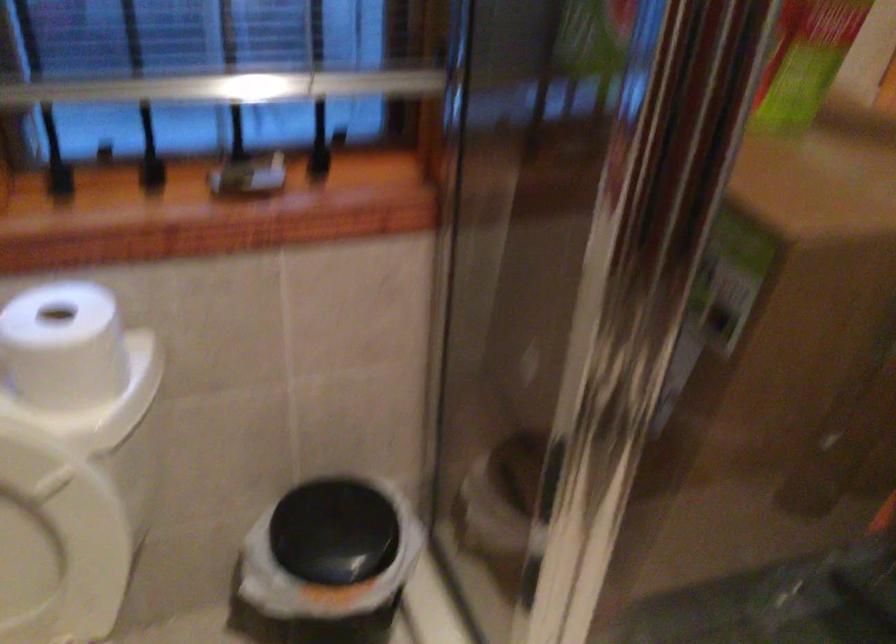
Image resolution: width=896 pixels, height=644 pixels. In order to click on white toilet roll holder in this screenshot , I will do `click(64, 346)`.